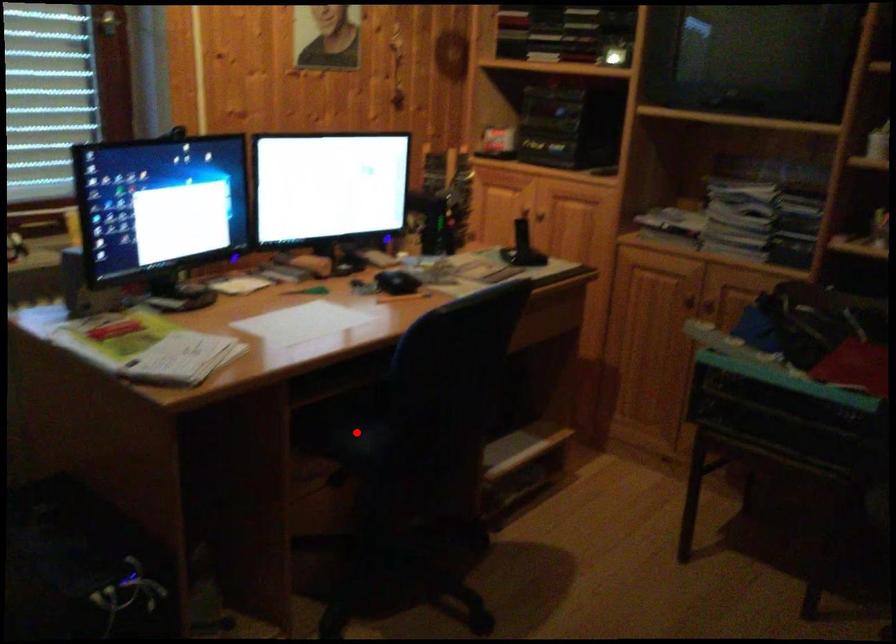
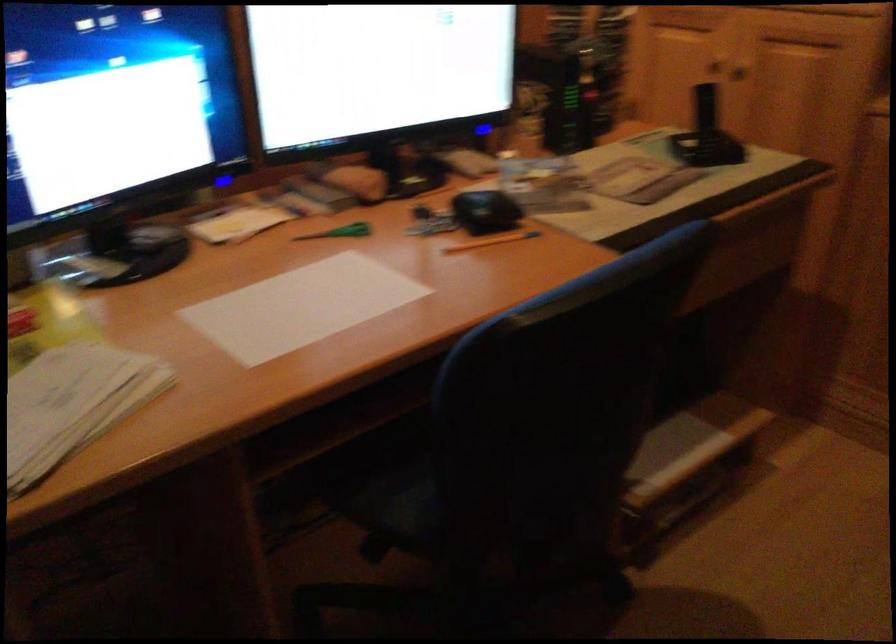
Find the pixel in the second image that matches the highlighted location in the first image.

(400, 488)